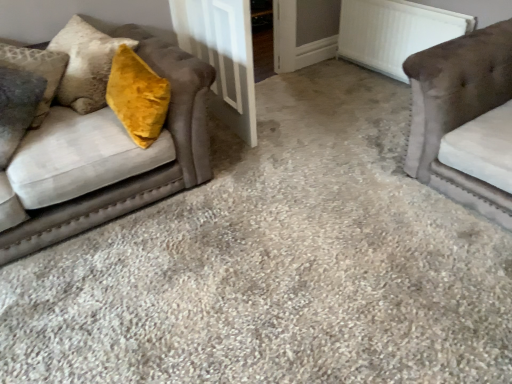
Question: In the image, is white textured radiator at upper right positioned in front of or behind white wood door at center?

Choices:
 (A) front
 (B) behind

Answer: (B)

Question: Looking at the image, does white textured radiator at upper right seem bigger or smaller compared to white wood door at center?

Choices:
 (A) big
 (B) small

Answer: (B)

Question: Which object is positioned farthest from the velvet brown couch at left, placed as the first studio couch when sorted from left to right?

Choices:
 (A) white wood door at center
 (B) suede-like beige couch at right, which is counted as the 1th studio couch, starting from the right
 (C) white textured radiator at upper right

Answer: (C)

Question: Based on their relative distances, which object is nearer to the suede-like beige couch at right, which is counted as the 1th studio couch, starting from the right?

Choices:
 (A) white textured radiator at upper right
 (B) velvet brown couch at left, which is the 2th studio couch in right-to-left order
 (C) white wood door at center

Answer: (A)